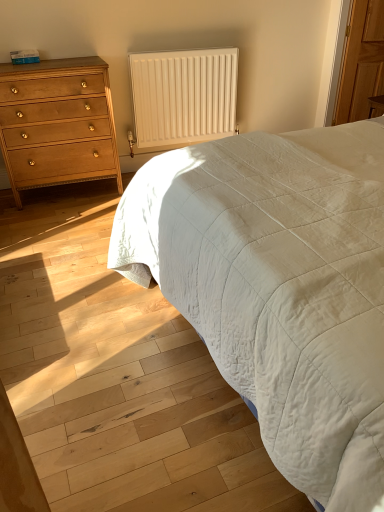
Where is `free space on the front side of matte wood chest of drawers at left`? free space on the front side of matte wood chest of drawers at left is located at coordinates (43, 226).